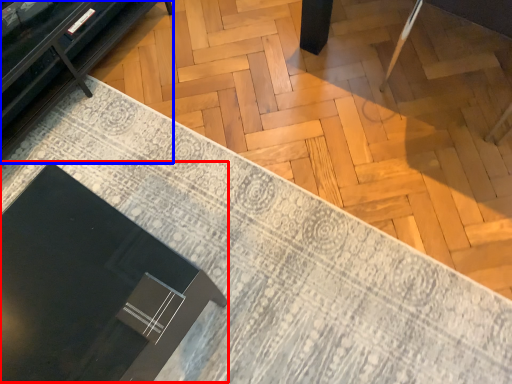
Question: Which point is closer to the camera, round table (highlighted by a red box) or furniture (highlighted by a blue box)?

Choices:
 (A) round table
 (B) furniture

Answer: (A)